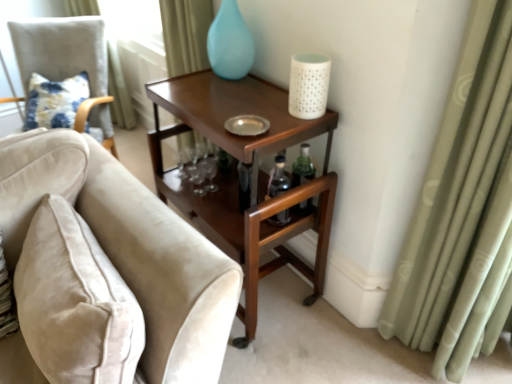
Locate an element on the screen. The image size is (512, 384). vacant area that is in front of white textured candle at upper right is located at coordinates (294, 129).